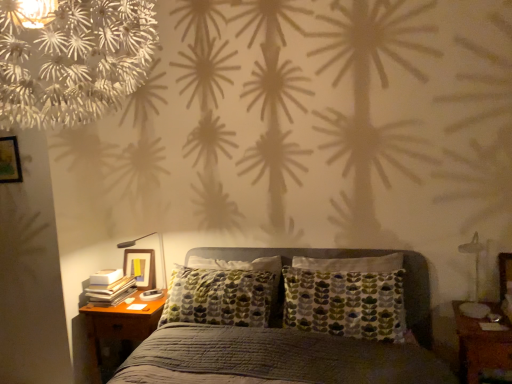
Question: Considering the relative sizes of textured gray bed at center and wooden nightstand at lower left, placed as the 2th nightstand when sorted from front to back, in the image provided, is textured gray bed at center shorter than wooden nightstand at lower left, placed as the 2th nightstand when sorted from front to back,?

Choices:
 (A) no
 (B) yes

Answer: (A)

Question: Is textured gray bed at center thinner than wooden nightstand at lower left, placed as the 2th nightstand when sorted from front to back?

Choices:
 (A) no
 (B) yes

Answer: (A)

Question: Is textured gray bed at center further to the viewer compared to wooden nightstand at lower left, which appears as the 1th nightstand when viewed from the left?

Choices:
 (A) no
 (B) yes

Answer: (A)

Question: Is textured gray bed at center next to wooden nightstand at lower left, which appears as the 1th nightstand when viewed from the left, and touching it?

Choices:
 (A) no
 (B) yes

Answer: (A)

Question: Is textured gray bed at center to the right of wooden nightstand at lower left, which ranks as the 1th nightstand in back-to-front order, from the viewer's perspective?

Choices:
 (A) no
 (B) yes

Answer: (B)

Question: Is wooden nightstand at lower left, which ranks as the 1th nightstand in back-to-front order, inside textured gray bed at center?

Choices:
 (A) yes
 (B) no

Answer: (A)

Question: Is wooden picture frame at upper left to the left of matte black lamp at left, the 2th bedside lamp in the right-to-left sequence, from the viewer's perspective?

Choices:
 (A) yes
 (B) no

Answer: (A)

Question: Is wooden picture frame at upper left at the right side of matte black lamp at left, the 1th bedside lamp in the back-to-front sequence?

Choices:
 (A) no
 (B) yes

Answer: (A)

Question: Is wooden picture frame at upper left thinner than matte black lamp at left, the 1th bedside lamp in the back-to-front sequence?

Choices:
 (A) no
 (B) yes

Answer: (B)

Question: Does wooden picture frame at upper left touch matte black lamp at left, which ranks as the 2th bedside lamp in front-to-back order?

Choices:
 (A) yes
 (B) no

Answer: (B)

Question: Can you confirm if wooden picture frame at upper left is taller than matte black lamp at left, the 2th bedside lamp in the right-to-left sequence?

Choices:
 (A) yes
 (B) no

Answer: (B)

Question: Is matte black lamp at left, which ranks as the 2th bedside lamp in front-to-back order, at the back of wooden picture frame at upper left?

Choices:
 (A) no
 (B) yes

Answer: (A)

Question: Can you confirm if brown wooden nightstand at lower right, the first nightstand positioned from the right, is smaller than matte black lamp at left, the 1th bedside lamp in the back-to-front sequence?

Choices:
 (A) no
 (B) yes

Answer: (A)